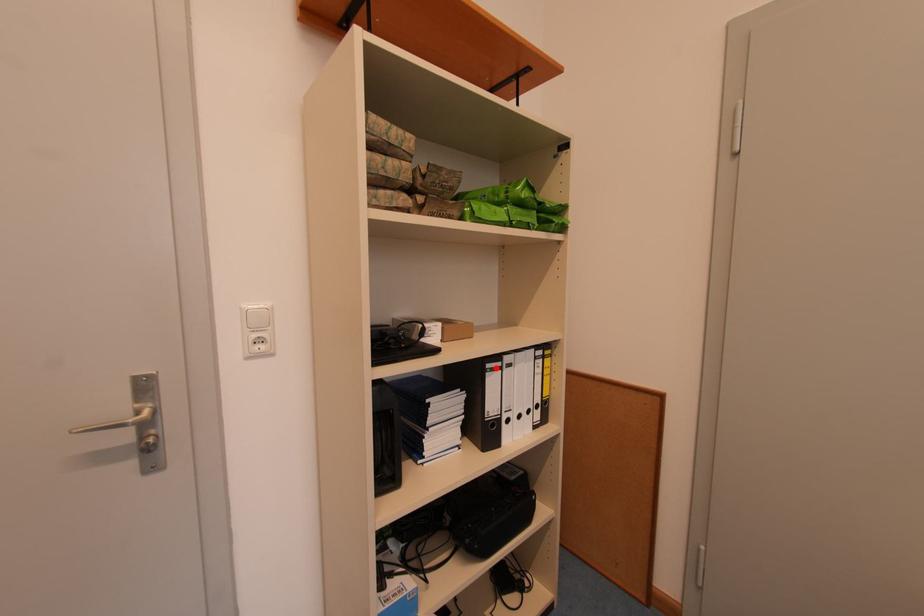
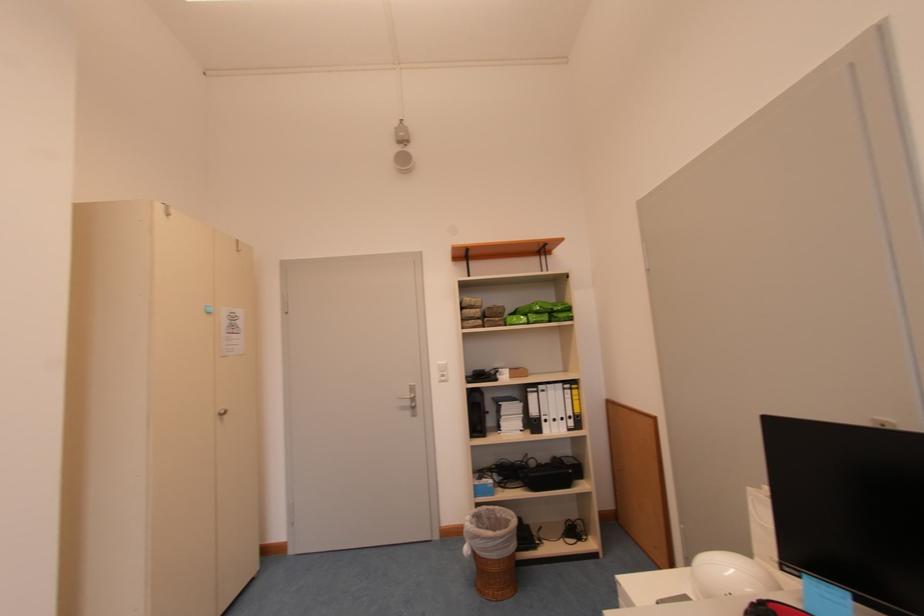
Find the pixel in the second image that matches the highlighted location in the first image.

(536, 392)